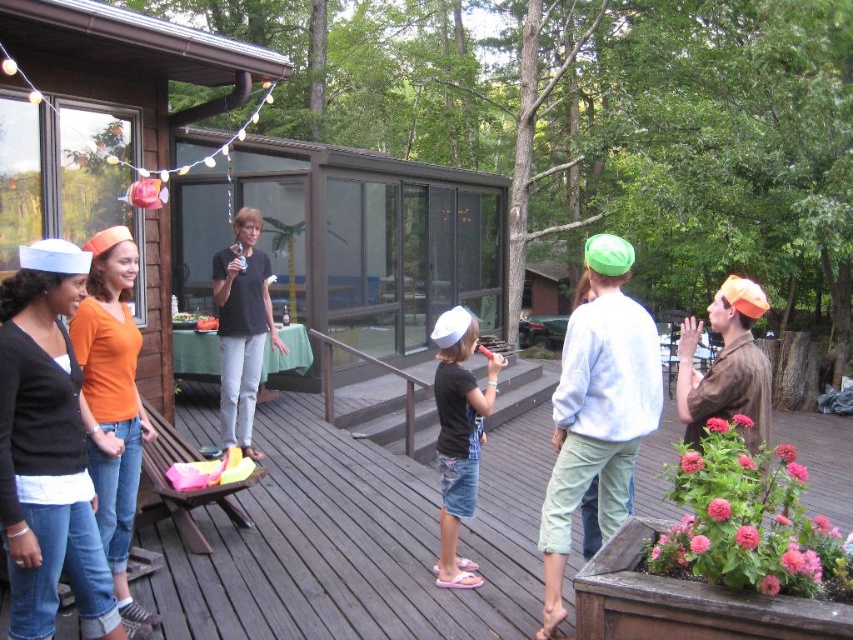
Question: Considering the real-world distances, which object is farthest from the light green cotton pants at right?

Choices:
 (A) matte black shirt at center
 (B) black cotton shirt at center
 (C) orange fabric cap at right

Answer: (B)

Question: Which object is farther from the camera taking this photo?

Choices:
 (A) orange fabric cap at right
 (B) black cotton shirt at center
 (C) light green cotton pants at right

Answer: (B)

Question: Does wooden deck at center have a larger size compared to matte black shirt at center?

Choices:
 (A) yes
 (B) no

Answer: (B)

Question: Is wooden deck at center below black cotton shirt at center?

Choices:
 (A) yes
 (B) no

Answer: (A)

Question: Does matte black cardigan at left have a lesser width compared to light green cotton pants at right?

Choices:
 (A) yes
 (B) no

Answer: (A)

Question: Which object is closer to the camera taking this photo?

Choices:
 (A) matte black shirt at center
 (B) light green cotton pants at right
 (C) wooden deck at center

Answer: (B)